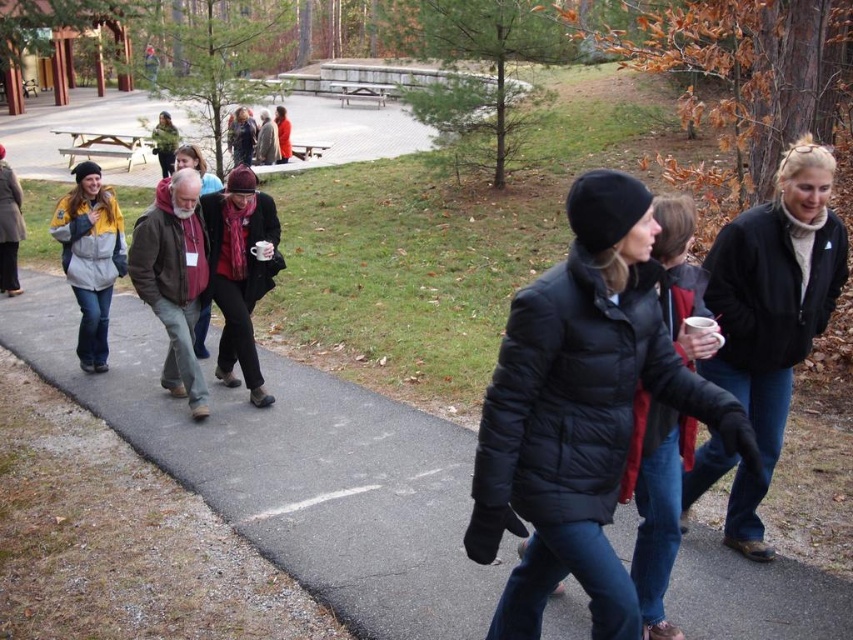
You are standing at the origin point of the image coordinate system. The brown leather jacket at center is located at point 0.436, 0.204. If you want to walk directly towards the jacket, which direction should you move in terms of the coordinate system?

To move directly towards the brown leather jacket at center located at coordinate point (173, 278) from the origin, you should move in the positive x and positive y directions since both coordinates are greater than zero.

You are standing at the origin point of the image coordinate system. Where is the black puffy jacket at center located in terms of coordinates?

The black puffy jacket at center is located at coordinates approximately 0.642 on the x axis and 0.682 on the y axis.

You are an observer standing on the path in the park. You notice two items of clothing in the scene. Which one is taller, the knitted wool scarf at center or the green wool sweater at upper left?

The knitted wool scarf at center is taller than the green wool sweater at upper left.